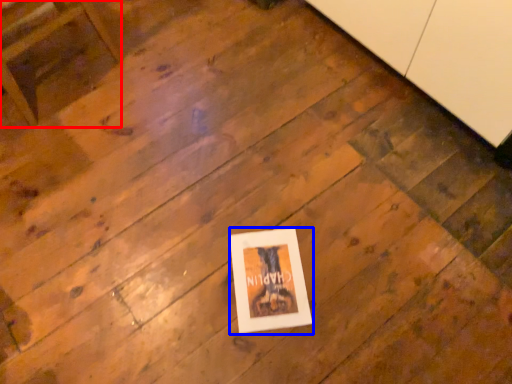
Question: Among these objects, which one is farthest to the camera, furniture (highlighted by a red box) or picture frame (highlighted by a blue box)?

Choices:
 (A) furniture
 (B) picture frame

Answer: (B)